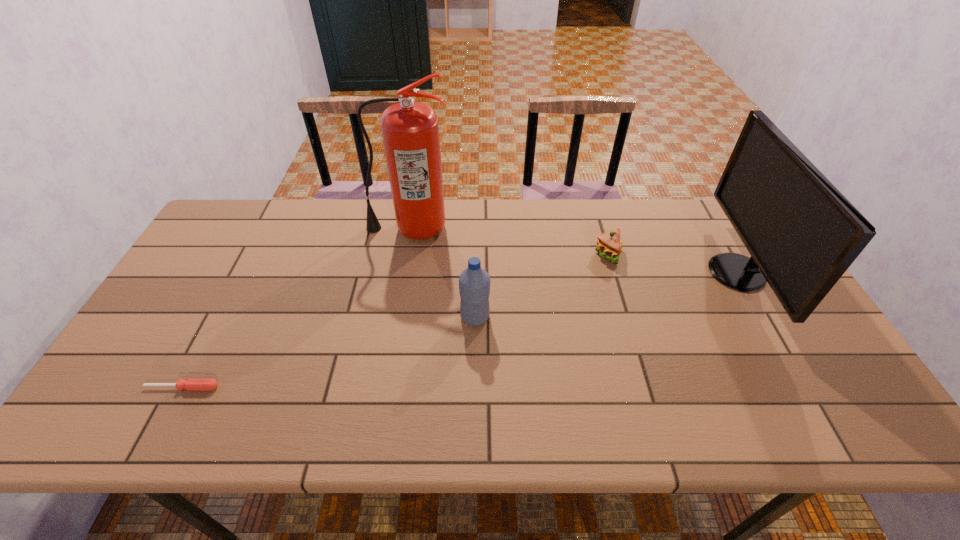
This screenshot has height=540, width=960. Find the location of `free space between the nearest object and the water bottle`. free space between the nearest object and the water bottle is located at coordinates (328, 352).

In order to click on empty location between the water bottle and the second shortest object in this screenshot , I will do `click(541, 286)`.

Where is `free space between the fourth tallest object and the fourth object from right to left`? The height and width of the screenshot is (540, 960). free space between the fourth tallest object and the fourth object from right to left is located at coordinates (509, 241).

In order to click on vacant area that lies between the sandwich and the fire extinguisher in this screenshot , I will do `click(509, 241)`.

This screenshot has height=540, width=960. Find the location of `free point between the fourth tallest object and the leftmost object`. free point between the fourth tallest object and the leftmost object is located at coordinates (395, 321).

The width and height of the screenshot is (960, 540). In order to click on free spot between the tallest object and the third object from right to left in this screenshot , I will do `click(443, 273)`.

Image resolution: width=960 pixels, height=540 pixels. I want to click on free space between the water bottle and the computer monitor, so click(606, 295).

You are a GUI agent. You are given a task and a screenshot of the screen. Output one action in this format:
    pyautogui.click(x=<x>, y=<y>)
    Task: Click on the object that is the fourth closest to the third object from right to left
    
    Given the screenshot: What is the action you would take?
    pyautogui.click(x=802, y=233)

Where is `object that is the third closest to the fourth object from right to left`? This screenshot has height=540, width=960. object that is the third closest to the fourth object from right to left is located at coordinates click(x=191, y=384).

Where is `vacant space that satisfies the following two spatial constraints: 1. on the instruction side of the fire extinguisher; 2. on the left side of the sandwich`? vacant space that satisfies the following two spatial constraints: 1. on the instruction side of the fire extinguisher; 2. on the left side of the sandwich is located at coordinates (405, 254).